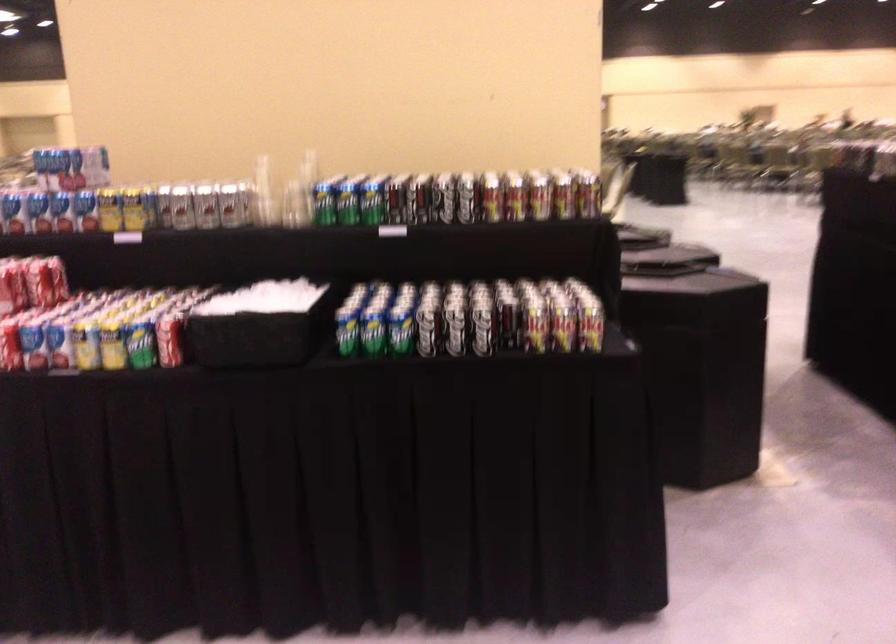
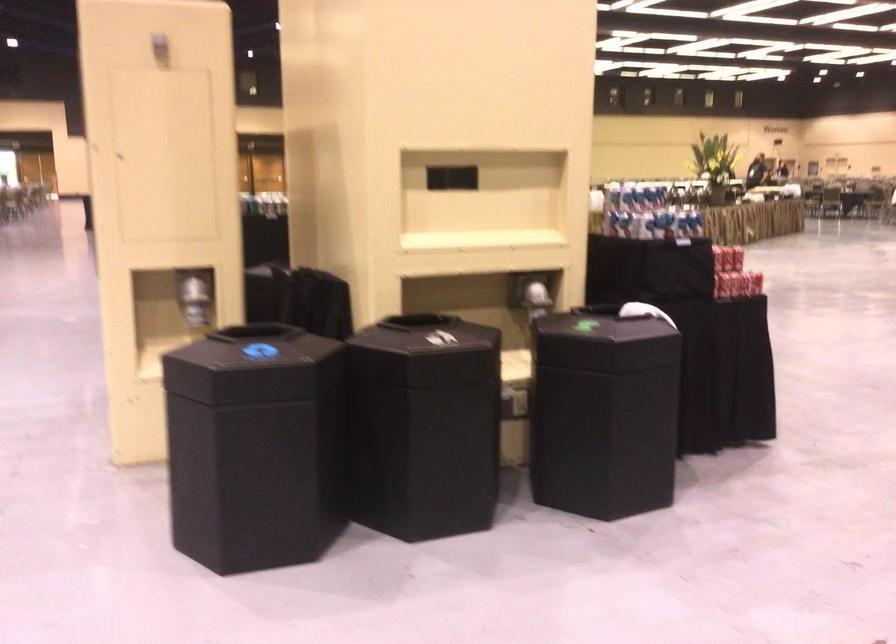
Question: I am providing you with two images of the same scene from different viewpoints. Which of the following objects are not visible in image2?

Choices:
 (A) black bin lid
 (B) red house magnet
 (C) shiny dispenser lever
 (D) yellow soda can

Answer: (D)